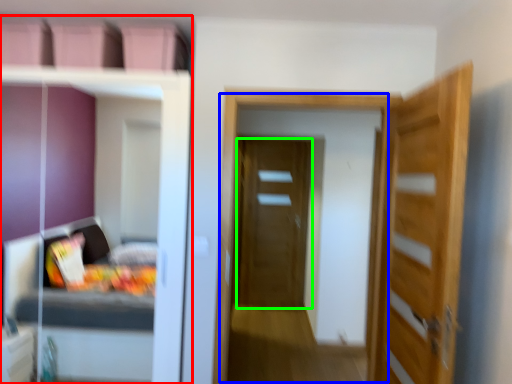
Question: Based on their relative distances, which object is farther from dresser (highlighted by a red box)? Choose from screen door (highlighted by a blue box) and door (highlighted by a green box).

Choices:
 (A) screen door
 (B) door

Answer: (B)